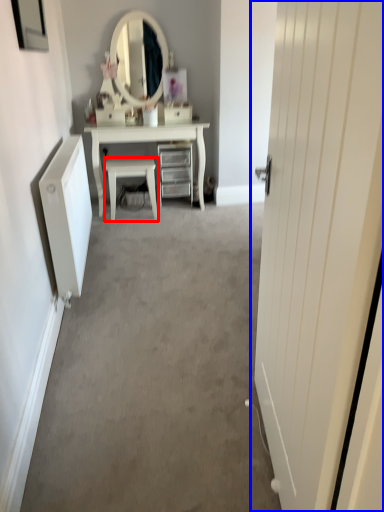
Question: Which of the following is the farthest to the observer, chair (highlighted by a red box) or door (highlighted by a blue box)?

Choices:
 (A) chair
 (B) door

Answer: (A)